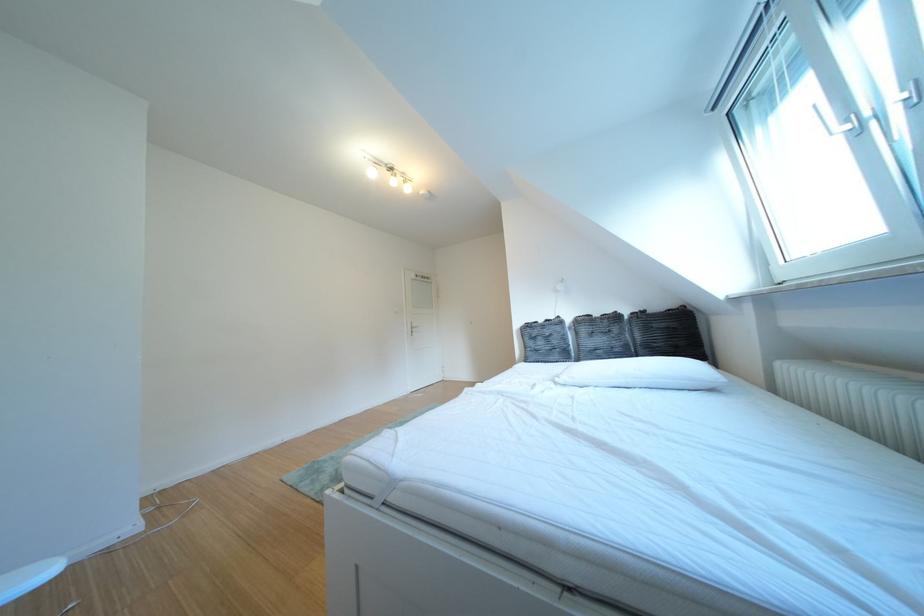
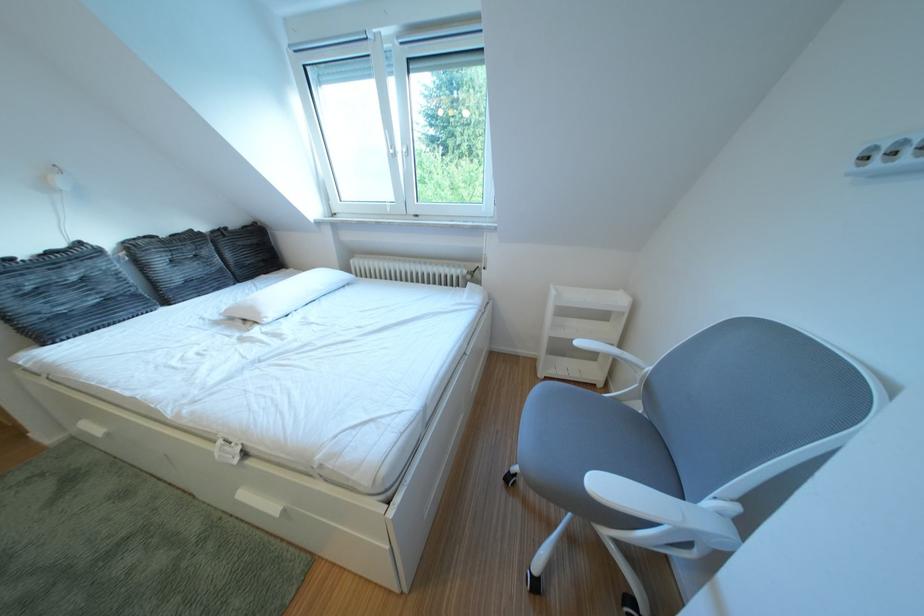
Find the pixel in the second image that matches point (671, 310) in the first image.

(247, 228)